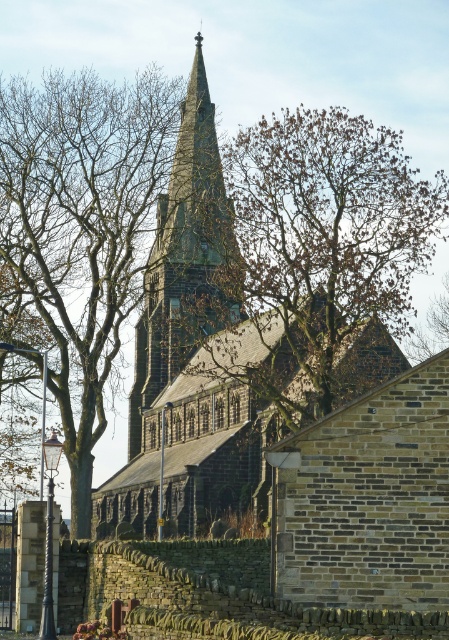
You are standing in front of the historic church and notice two points marked in the image. The first point is at coordinates point (29, 186) and the second is at point (208, 284). Which point is nearer to your current position?

Point (29, 186) is closer to the camera than point (208, 284), so the first point is nearer to your current position.

You are standing in front of the historic church and notice a brown leafy tree at center and a dark gray stone steeple at center. Which object is located to the right of the other?

The brown leafy tree at center is positioned on the right side of dark gray stone steeple at center.

You are standing in front of the historic church and want to take a photo of the dark gray stone steeple at center without any obstructions. Is the brown leafy tree at center blocking your view of the steeple?

The brown leafy tree at center is in front of the dark gray stone steeple at center, so it is blocking the view of the steeple.